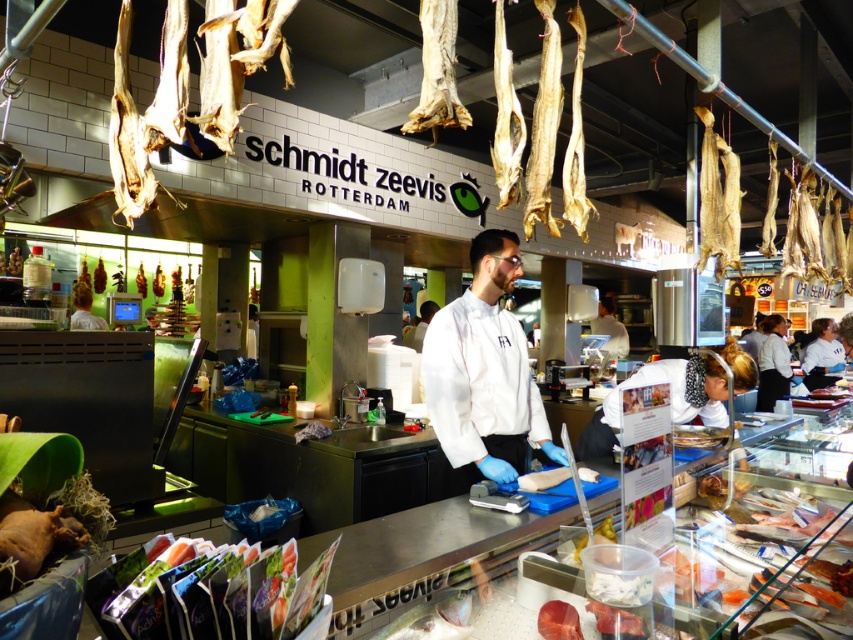
Between point (546, 602) and point (80, 276), which one is positioned in front?

Point (546, 602) is more forward.

Which is below, pinkish raw meat at center or shiny metallic knife at center?

pinkish raw meat at center is lower down.

Is point (560, 614) closer to camera compared to point (82, 266)?

Yes, point (560, 614) is closer to viewer.

Where is `pinkish raw meat at center`? This screenshot has height=640, width=853. pinkish raw meat at center is located at coordinates (558, 620).

Does point (567, 612) lie in front of point (96, 278)?

That is True.

Between pinkish raw meat at center and dried fish at upper center, which one is positioned lower?

pinkish raw meat at center is below.

Find the location of a particular element. pinkish raw meat at center is located at coordinates (558, 620).

Can you confirm if dried fish at upper center is positioned to the left of shiny metallic knife at center?

Incorrect, dried fish at upper center is not on the left side of shiny metallic knife at center.

Looking at this image, which of these two, dried fish at upper center or shiny metallic knife at center, stands shorter?

shiny metallic knife at center

The image size is (853, 640). Identify the location of dried fish at upper center. (x=99, y=276).

The height and width of the screenshot is (640, 853). Find the location of `dried fish at upper center`. dried fish at upper center is located at coordinates (99, 276).